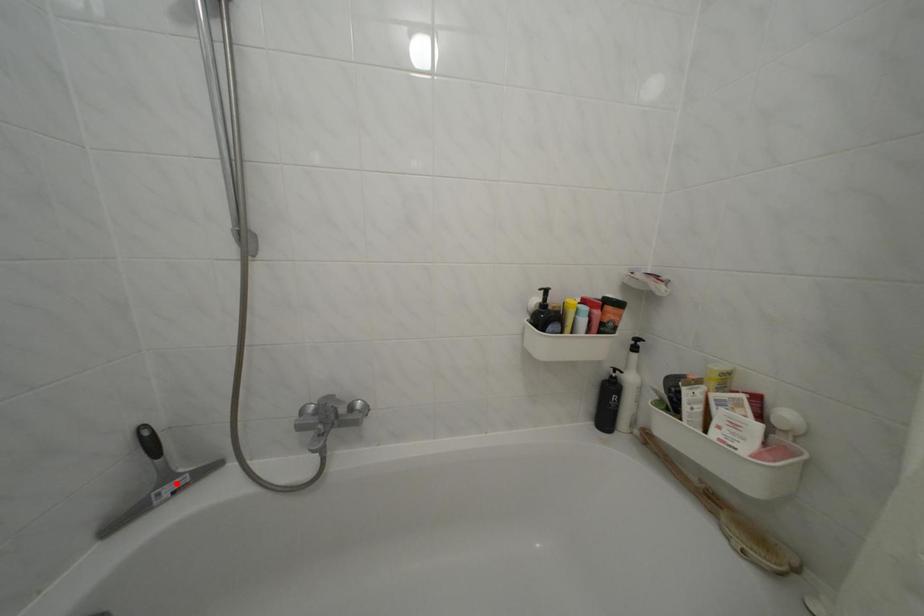
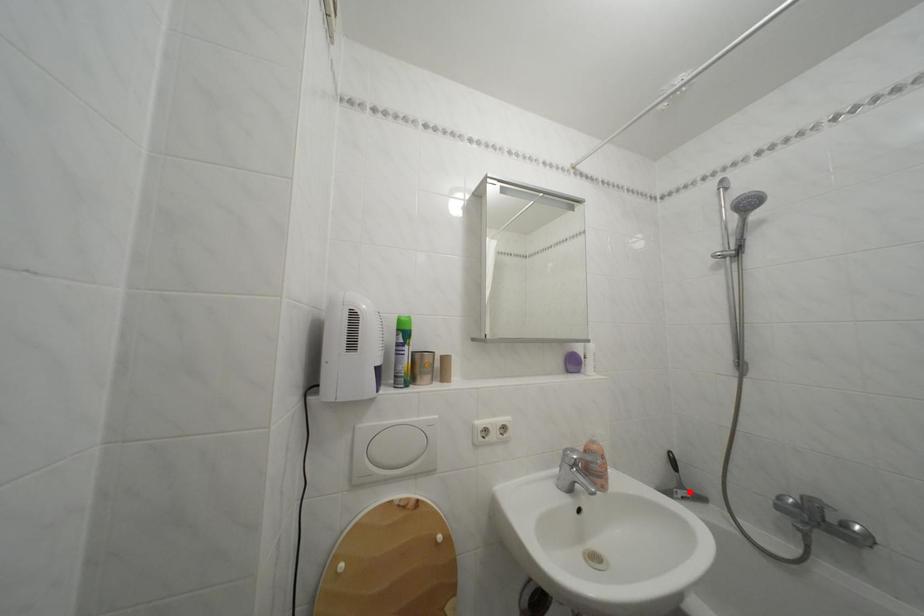
I am providing you with two images of the same scene from different viewpoints. A red point is marked on the first image and another point is marked on the second image. Does the point marked in image1 correspond to the same location as the one in image2?

Yes